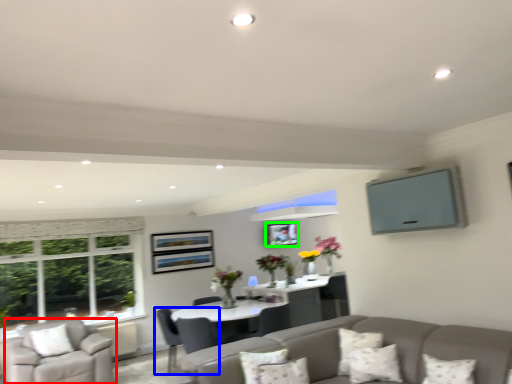
Question: Estimate the real-world distances between objects in this image. Which object is farther from chair (highlighted by a red box), chair (highlighted by a blue box) or picture frame (highlighted by a green box)?

Choices:
 (A) chair
 (B) picture frame

Answer: (B)